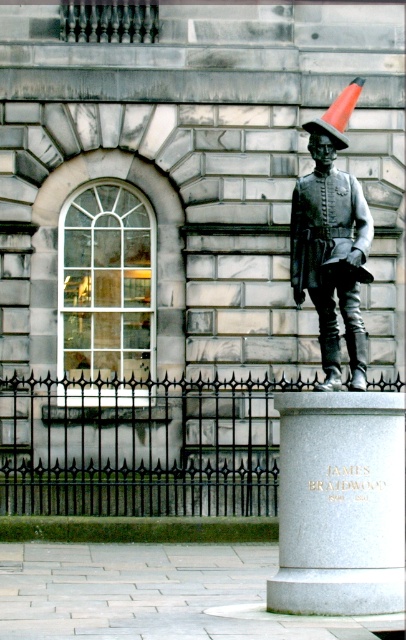
Question: Is polished bronze statue at right positioned at the back of bronze metallic uniform at center?

Choices:
 (A) no
 (B) yes

Answer: (A)

Question: Does polished bronze statue at right come in front of bronze metallic uniform at center?

Choices:
 (A) yes
 (B) no

Answer: (A)

Question: Can you confirm if polished bronze statue at right is positioned below bronze metallic uniform at center?

Choices:
 (A) yes
 (B) no

Answer: (A)

Question: Which point is closer to the camera taking this photo?

Choices:
 (A) (360, 410)
 (B) (358, 292)

Answer: (A)

Question: Which point is closer to the camera?

Choices:
 (A) bronze metallic uniform at center
 (B) polished bronze statue at right

Answer: (B)